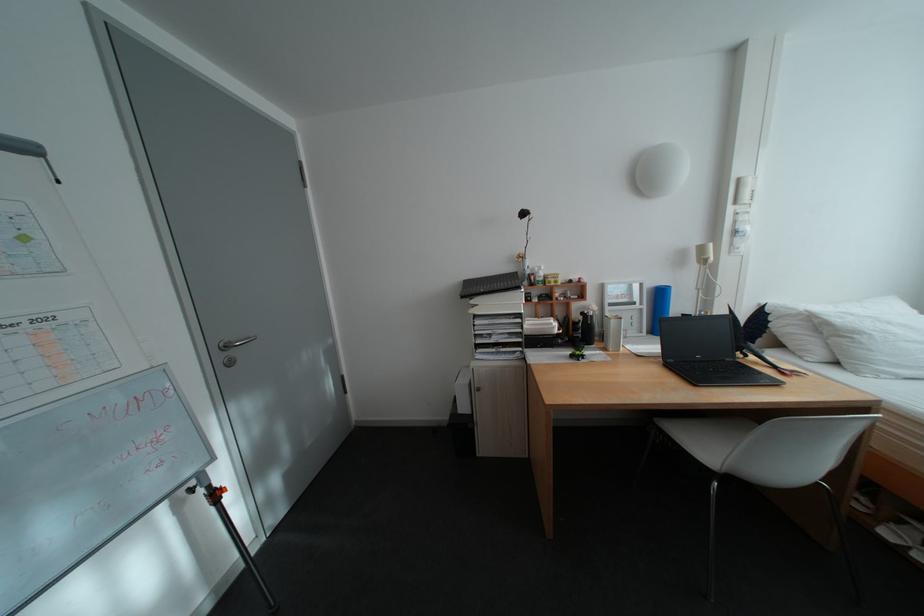
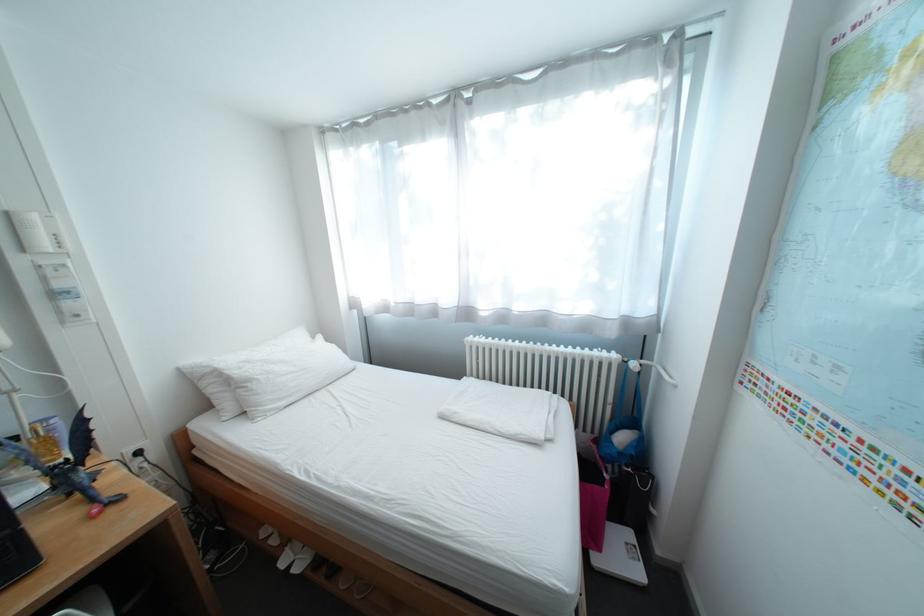
The point at [871,334] is marked in the first image. Where is the corresponding point in the second image?

(263, 383)